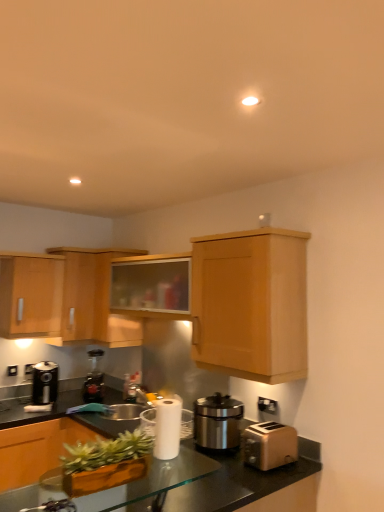
Question: From the image's perspective, is satin silver sink at center on top of transparent glass table at lower center?

Choices:
 (A) no
 (B) yes

Answer: (A)

Question: Can you confirm if satin silver sink at center is smaller than transparent glass table at lower center?

Choices:
 (A) no
 (B) yes

Answer: (B)

Question: Can you confirm if satin silver sink at center is shorter than transparent glass table at lower center?

Choices:
 (A) no
 (B) yes

Answer: (B)

Question: Considering the relative sizes of satin silver sink at center and transparent glass table at lower center in the image provided, is satin silver sink at center taller than transparent glass table at lower center?

Choices:
 (A) yes
 (B) no

Answer: (B)

Question: Considering the relative sizes of satin silver sink at center and transparent glass table at lower center in the image provided, is satin silver sink at center thinner than transparent glass table at lower center?

Choices:
 (A) no
 (B) yes

Answer: (A)

Question: Is satin silver sink at center in contact with transparent glass table at lower center?

Choices:
 (A) no
 (B) yes

Answer: (A)

Question: Would you consider green matte planter at lower left to be distant from light wood cabinet at left, the fifth cabinetry positioned from the right?

Choices:
 (A) yes
 (B) no

Answer: (A)

Question: From a real-world perspective, is green matte planter at lower left beneath light wood cabinet at left, the fifth cabinetry positioned from the right?

Choices:
 (A) yes
 (B) no

Answer: (A)

Question: Is green matte planter at lower left shorter than light wood cabinet at left, the first cabinetry when ordered from left to right?

Choices:
 (A) yes
 (B) no

Answer: (A)

Question: Is light wood cabinet at left, the fifth cabinetry positioned from the right, surrounded by green matte planter at lower left?

Choices:
 (A) yes
 (B) no

Answer: (B)

Question: Is green matte planter at lower left facing away from light wood cabinet at left, the fifth cabinetry positioned from the right?

Choices:
 (A) no
 (B) yes

Answer: (A)

Question: Does green matte planter at lower left have a lesser width compared to light wood cabinet at left, the fifth cabinetry positioned from the right?

Choices:
 (A) yes
 (B) no

Answer: (A)

Question: Is the surface of satin silver sink at center in direct contact with black metallic coffee machine at left, acting as the second coffee machine starting from the right?

Choices:
 (A) yes
 (B) no

Answer: (B)